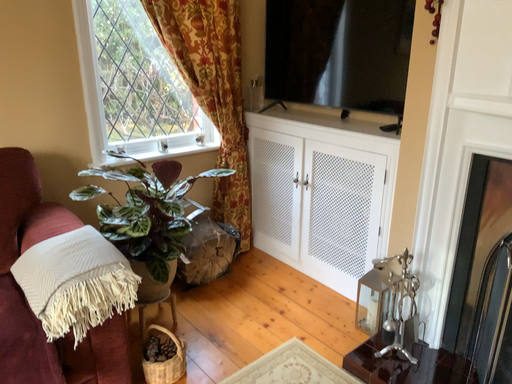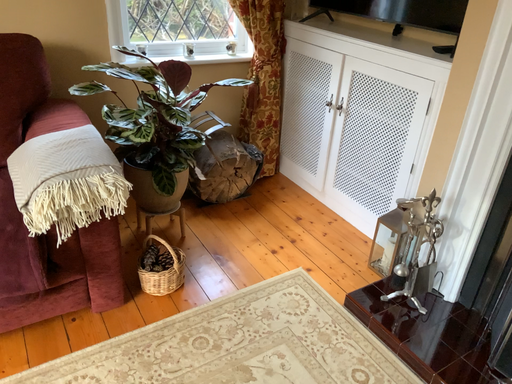
Question: How did the camera likely rotate when shooting the video?

Choices:
 (A) rotated downward
 (B) rotated upward

Answer: (A)